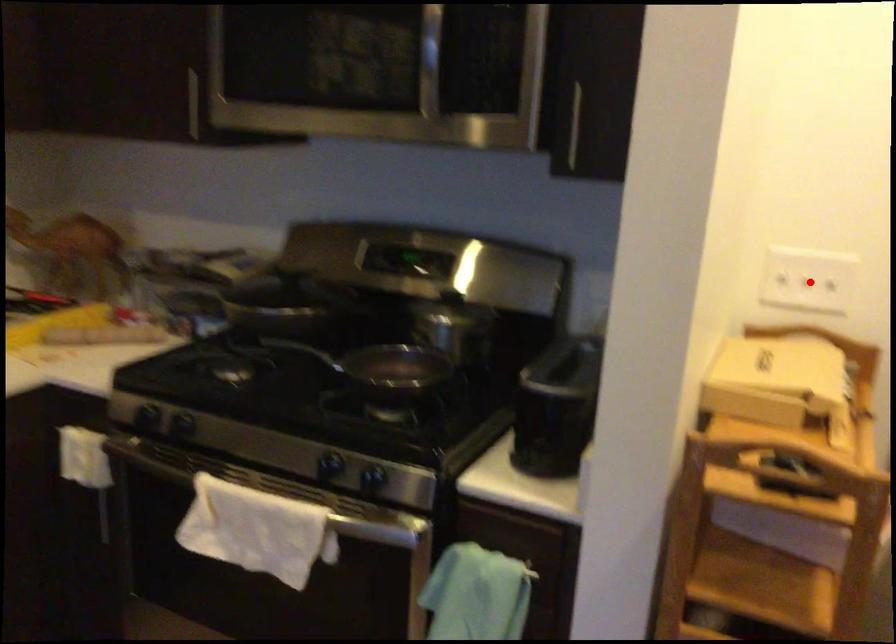
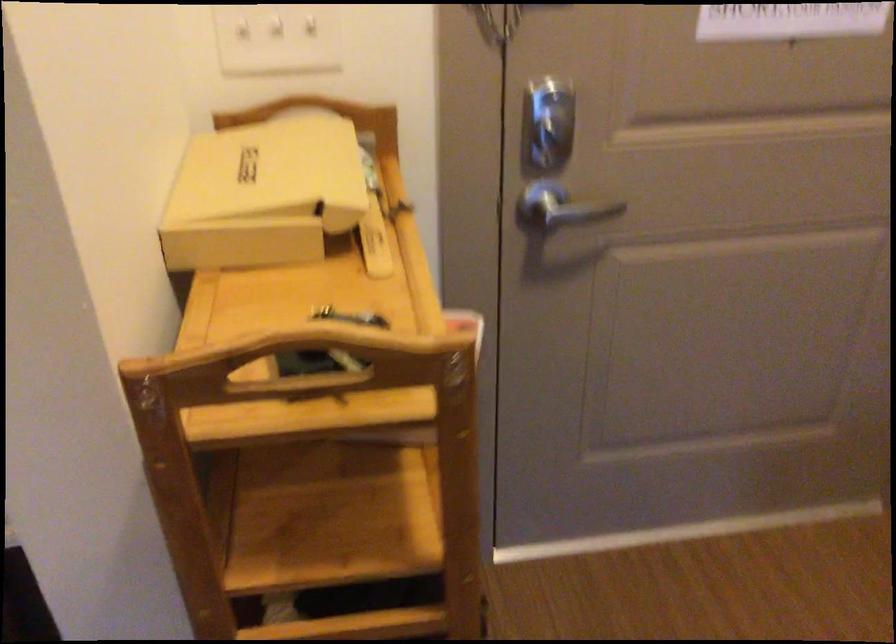
The point at the highlighted location is marked in the first image. Where is the corresponding point in the second image?

(276, 39)